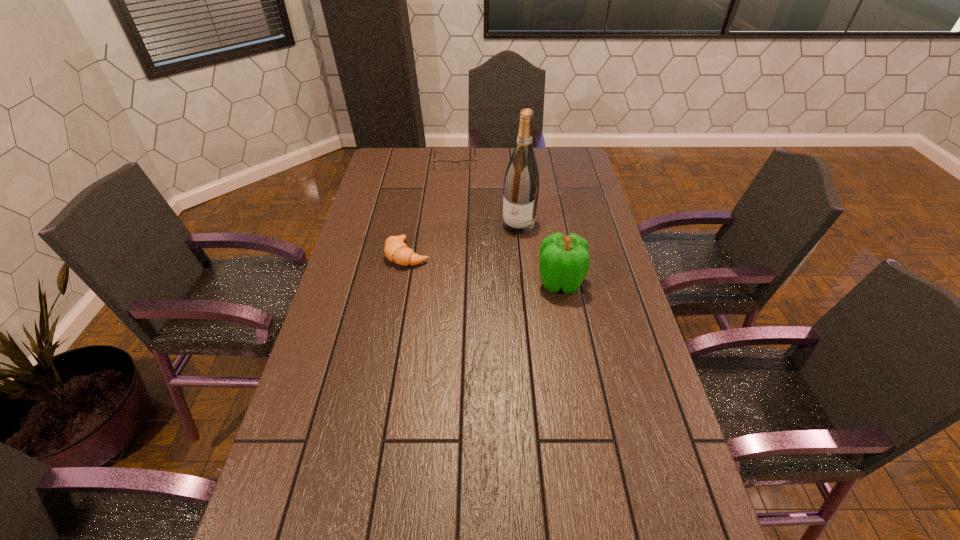
You are a GUI agent. You are given a task and a screenshot of the screen. Output one action in this format:
    pyautogui.click(x=<x>, y=<y>)
    Task: Click on the vacant space at the right edge of the desktop
    
    Given the screenshot: What is the action you would take?
    pyautogui.click(x=594, y=239)

Locate an element on the screen. Image resolution: width=960 pixels, height=540 pixels. free location at the far right corner is located at coordinates (585, 176).

Locate an element on the screen. vacant space at the near right corner of the desktop is located at coordinates (691, 519).

Locate an element on the screen. vacant region between the farthest object and the crescent roll is located at coordinates (431, 207).

You are a GUI agent. You are given a task and a screenshot of the screen. Output one action in this format:
    pyautogui.click(x=<x>, y=<y>)
    Task: Click on the vacant area that lies between the second shortest object and the spectacles
    
    Given the screenshot: What is the action you would take?
    pyautogui.click(x=431, y=207)

Locate an element on the screen. This screenshot has width=960, height=540. empty space between the wine bottle and the spectacles is located at coordinates (487, 193).

Locate an element on the screen. This screenshot has height=540, width=960. vacant space that is in between the third tallest object and the bell pepper is located at coordinates [x=484, y=268].

Find the location of a particular element. Image resolution: width=960 pixels, height=540 pixels. free space between the wine bottle and the crescent roll is located at coordinates point(463,239).

The height and width of the screenshot is (540, 960). I want to click on vacant area that lies between the wine bottle and the crescent roll, so click(463, 239).

This screenshot has width=960, height=540. Identify the location of free space between the crescent roll and the shortest object. (431, 207).